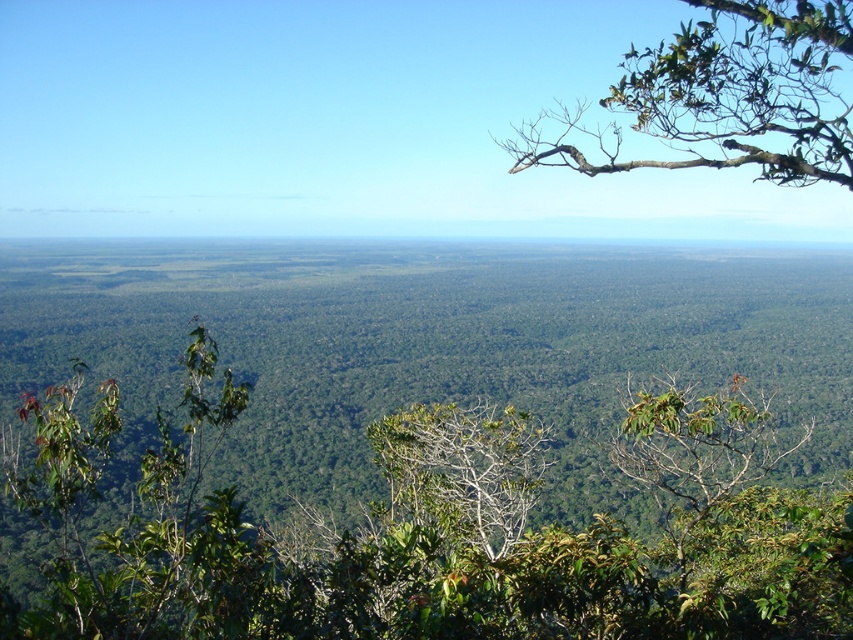
You are a hiker trying to navigate through the forest and need to reach a landmark. You see a green leafy tree at center and a green leafy branch at upper right. Which one is closer to you?

The green leafy tree at center is closer to you because it is 63.50 meters away from the green leafy branch at upper right, meaning the branch is farther away.

You are standing in the forest and see the green leafy tree at center and the green leafy branch at upper right. Which object is higher up in the image?

The green leafy branch at upper right is higher up in the image because it is positioned above the green leafy tree at center.